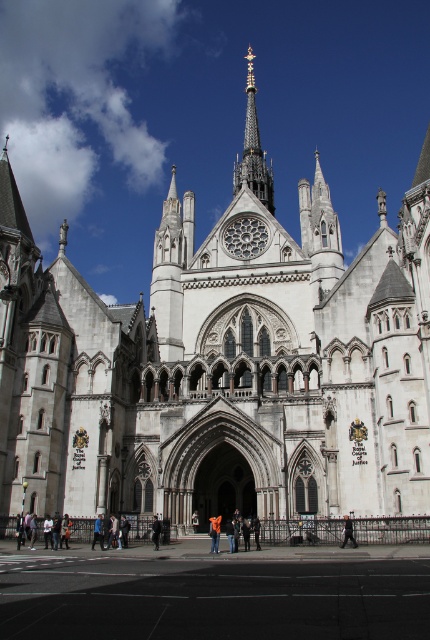
Question: Which is farther from the dark gray jacket at center?

Choices:
 (A) polished steel spire at upper center
 (B) blue fabric jacket at lower left
 (C) black fabric person at center

Answer: (A)

Question: Can you confirm if dark gray jacket at center is positioned below black fabric person at center?

Choices:
 (A) yes
 (B) no

Answer: (B)

Question: Which point is farther to the camera?

Choices:
 (A) (248, 184)
 (B) (101, 524)
 (C) (349, 534)
 (D) (156, 524)

Answer: (A)

Question: Is blue fabric jacket at lower left smaller than black fabric person at center?

Choices:
 (A) no
 (B) yes

Answer: (B)

Question: Which of the following is the closest to the observer?

Choices:
 (A) black fabric person at center
 (B) blue fabric jacket at lower left
 (C) dark gray jacket at center

Answer: (C)

Question: Is polished steel spire at upper center positioned at the back of dark gray jacket at center?

Choices:
 (A) no
 (B) yes

Answer: (B)